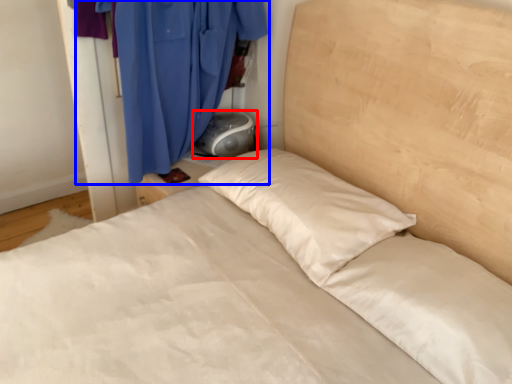
Question: Which object is further to the camera taking this photo, gray (highlighted by a red box) or curtain (highlighted by a blue box)?

Choices:
 (A) gray
 (B) curtain

Answer: (A)